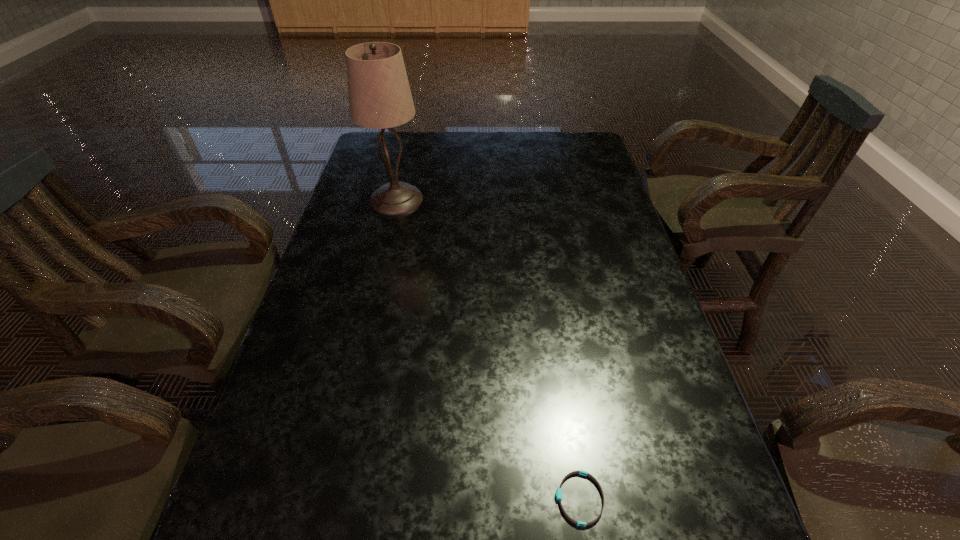
Locate an element on the screen. This screenshot has width=960, height=540. free spot at the left edge of the desktop is located at coordinates (316, 462).

In the image, there is a desktop. Identify the location of vacant space at the right edge. Image resolution: width=960 pixels, height=540 pixels. (571, 195).

The height and width of the screenshot is (540, 960). I want to click on vacant space at the far left corner of the desktop, so click(x=398, y=148).